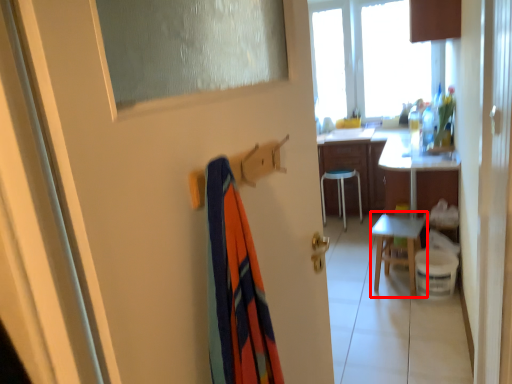
Question: From the image's perspective, where is chair (annotated by the red box) located in relation to desk in the image?

Choices:
 (A) below
 (B) above

Answer: (A)